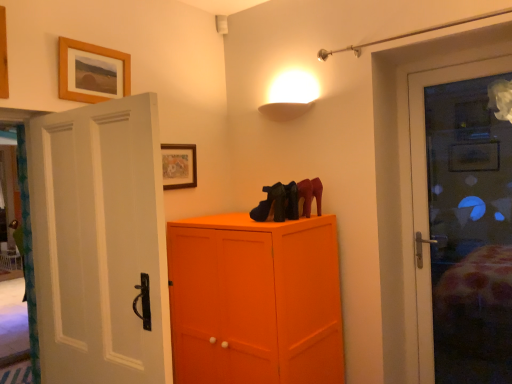
What do you see at coordinates (92, 72) in the screenshot? The image size is (512, 384). I see `wooden picture frame at upper center, the 2th picture frame from the right` at bounding box center [92, 72].

The image size is (512, 384). What are the coordinates of `wooden picture frame at upper center, which is counted as the first picture frame, starting from the front` in the screenshot? It's located at (92, 72).

Locate an element on the screen. Image resolution: width=512 pixels, height=384 pixels. picture frame behind the wooden picture frame at upper center, the 2th picture frame from the right is located at coordinates (179, 166).

Is wooden picture frame at upper center, which is counted as the first picture frame, starting from the front, aimed at matte wooden picture frame at upper center, placed as the 1th picture frame when sorted from bottom to top?

No, wooden picture frame at upper center, which is counted as the first picture frame, starting from the front, is not oriented towards matte wooden picture frame at upper center, placed as the 1th picture frame when sorted from bottom to top.

Can you confirm if wooden picture frame at upper center, placed as the 2th picture frame when sorted from back to front, is wider than matte wooden picture frame at upper center, which is the first picture frame from right to left?

Indeed, wooden picture frame at upper center, placed as the 2th picture frame when sorted from back to front, has a greater width compared to matte wooden picture frame at upper center, which is the first picture frame from right to left.

From the image's perspective, who appears lower, wooden picture frame at upper center, which is counted as the first picture frame, starting from the front, or matte wooden picture frame at upper center, placed as the 1th picture frame when sorted from bottom to top?

matte wooden picture frame at upper center, placed as the 1th picture frame when sorted from bottom to top, is shown below in the image.

Based on the photo, are matte black shoes at center and matte wooden picture frame at upper center, placed as the 2th picture frame when sorted from front to back, making contact?

matte black shoes at center is not next to matte wooden picture frame at upper center, placed as the 2th picture frame when sorted from front to back, and they're not touching.

Considering the sizes of matte black shoes at center and matte wooden picture frame at upper center, acting as the 2th picture frame starting from the left, in the image, is matte black shoes at center bigger or smaller than matte wooden picture frame at upper center, acting as the 2th picture frame starting from the left,?

In the image, matte black shoes at center appears to be larger than matte wooden picture frame at upper center, acting as the 2th picture frame starting from the left.

Which of these two, matte black shoes at center or matte wooden picture frame at upper center, marked as the 2th picture frame in a top-to-bottom arrangement, is thinner?

Thinner between the two is matte wooden picture frame at upper center, marked as the 2th picture frame in a top-to-bottom arrangement.

Which is more to the right, matte black shoes at center or matte wooden picture frame at upper center, which is the first picture frame in back-to-front order?

Positioned to the right is matte black shoes at center.

Are matte black shoes at center and wooden picture frame at upper center, acting as the 1th picture frame starting from the left, located far from each other?

They are positioned close to each other.

Is point (277, 189) closer or farther from the camera than point (122, 88)?

Point (277, 189) is positioned closer to the camera compared to point (122, 88).

This screenshot has height=384, width=512. Find the location of `picture frame that is the 2nd object above the matte black shoes at center (from a real-world perspective)`. picture frame that is the 2nd object above the matte black shoes at center (from a real-world perspective) is located at coordinates (92, 72).

Consider the image. From the image's perspective, is matte black shoes at center above or below wooden picture frame at upper center, placed as the 2th picture frame when sorted from back to front?

Based on their image positions, matte black shoes at center is located beneath wooden picture frame at upper center, placed as the 2th picture frame when sorted from back to front.

Does matte wooden picture frame at upper center, which is the first picture frame from right to left, turn towards wooden picture frame at upper center, which is counted as the first picture frame, starting from the front?

No, matte wooden picture frame at upper center, which is the first picture frame from right to left, is not oriented towards wooden picture frame at upper center, which is counted as the first picture frame, starting from the front.

Does matte wooden picture frame at upper center, which is the first picture frame from right to left, come behind wooden picture frame at upper center, placed as the 2th picture frame when sorted from back to front?

Yes, matte wooden picture frame at upper center, which is the first picture frame from right to left, is further from the camera.

Image resolution: width=512 pixels, height=384 pixels. I want to click on picture frame located on the right of wooden picture frame at upper center, placed as the 2th picture frame when sorted from back to front, so click(x=179, y=166).

Between matte wooden picture frame at upper center, which is the first picture frame from right to left, and wooden picture frame at upper center, acting as the 1th picture frame starting from the left, which one has larger width?

wooden picture frame at upper center, acting as the 1th picture frame starting from the left.

Between wooden picture frame at upper center, which is counted as the first picture frame, starting from the front, and matte black shoes at center, which one has larger size?

Bigger between the two is wooden picture frame at upper center, which is counted as the first picture frame, starting from the front.

From a real-world perspective, is wooden picture frame at upper center, the 2th picture frame from the right, under matte black shoes at center?

No, from a real-world perspective, wooden picture frame at upper center, the 2th picture frame from the right, is not beneath matte black shoes at center.

Is wooden picture frame at upper center, placed as the 2th picture frame when sorted from back to front, far from matte black shoes at center?

No, there isn't a large distance between wooden picture frame at upper center, placed as the 2th picture frame when sorted from back to front, and matte black shoes at center.

Is wooden picture frame at upper center, acting as the 1th picture frame starting from the left, oriented away from matte black shoes at center?

No, wooden picture frame at upper center, acting as the 1th picture frame starting from the left, is not facing away from matte black shoes at center.

Does matte wooden picture frame at upper center, placed as the 1th picture frame when sorted from bottom to top, appear on the right side of matte black shoes at center?

In fact, matte wooden picture frame at upper center, placed as the 1th picture frame when sorted from bottom to top, is to the left of matte black shoes at center.

Where is `footwear below the matte wooden picture frame at upper center, which is the first picture frame from right to left (from the image's perspective)`? footwear below the matte wooden picture frame at upper center, which is the first picture frame from right to left (from the image's perspective) is located at coordinates (288, 200).

From the image's perspective, which one is positioned lower, matte wooden picture frame at upper center, placed as the 1th picture frame when sorted from bottom to top, or matte black shoes at center?

matte black shoes at center.

From a real-world perspective, which object rests below the other?

From a 3D spatial view, matte black shoes at center is below.

At what (x,y) coordinates should I click in order to perform the action: click on picture frame behind the wooden picture frame at upper center, the 2th picture frame from the right. Please return your answer as a coordinate pair (x, y). Looking at the image, I should click on (179, 166).

This screenshot has width=512, height=384. Identify the location of footwear lying below the matte wooden picture frame at upper center, placed as the 1th picture frame when sorted from bottom to top (from the image's perspective). (288, 200).

Estimate the real-world distances between objects in this image. Which object is closer to wooden picture frame at upper center, placed as the second picture frame when sorted from bottom to top, matte wooden picture frame at upper center, placed as the 1th picture frame when sorted from bottom to top, or matte black shoes at center?

The object closer to wooden picture frame at upper center, placed as the second picture frame when sorted from bottom to top, is matte wooden picture frame at upper center, placed as the 1th picture frame when sorted from bottom to top.

When comparing their distances from matte black shoes at center, does matte wooden picture frame at upper center, placed as the 2th picture frame when sorted from front to back, or wooden picture frame at upper center, placed as the 2th picture frame when sorted from back to front, seem closer?

Based on the image, matte wooden picture frame at upper center, placed as the 2th picture frame when sorted from front to back, appears to be nearer to matte black shoes at center.

When comparing their distances from matte wooden picture frame at upper center, marked as the 2th picture frame in a top-to-bottom arrangement, does wooden picture frame at upper center, which is counted as the first picture frame, starting from the front, or matte black shoes at center seem closer?

Based on the image, wooden picture frame at upper center, which is counted as the first picture frame, starting from the front, appears to be nearer to matte wooden picture frame at upper center, marked as the 2th picture frame in a top-to-bottom arrangement.

Looking at the image, which one is located further to matte black shoes at center, wooden picture frame at upper center, which is counted as the first picture frame, starting from the front, or matte wooden picture frame at upper center, which is the first picture frame from right to left?

Among the two, wooden picture frame at upper center, which is counted as the first picture frame, starting from the front, is located further to matte black shoes at center.

Considering their positions, is matte black shoes at center positioned further to matte wooden picture frame at upper center, marked as the 2th picture frame in a top-to-bottom arrangement, than wooden picture frame at upper center, marked as the first picture frame in a top-to-bottom arrangement?

matte black shoes at center.

From the image, which object appears to be nearer to wooden picture frame at upper center, which is counted as the first picture frame, starting from the front, matte black shoes at center or matte wooden picture frame at upper center, which is the first picture frame from right to left?

matte wooden picture frame at upper center, which is the first picture frame from right to left, lies closer to wooden picture frame at upper center, which is counted as the first picture frame, starting from the front, than the other object.

Where is `picture frame situated between wooden picture frame at upper center, the 2th picture frame from the right, and matte black shoes at center from left to right`? This screenshot has width=512, height=384. picture frame situated between wooden picture frame at upper center, the 2th picture frame from the right, and matte black shoes at center from left to right is located at coordinates (179, 166).